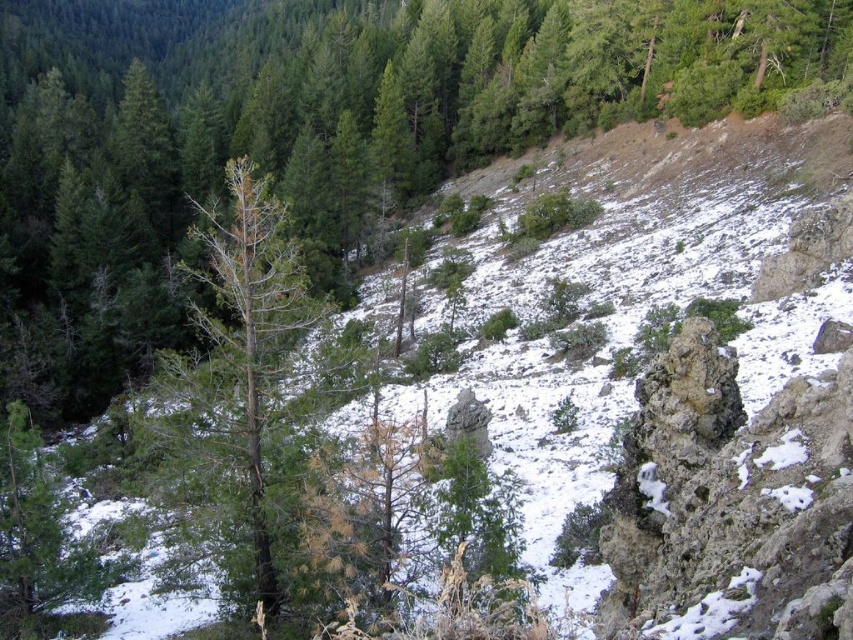
You are a hiker standing at the base of the mountain. You see two points marked in the image. Which point is closer to you, point [279,179] or point [260,502]?

Point [260,502] is closer to you because it is less further to the camera than point [279,179].